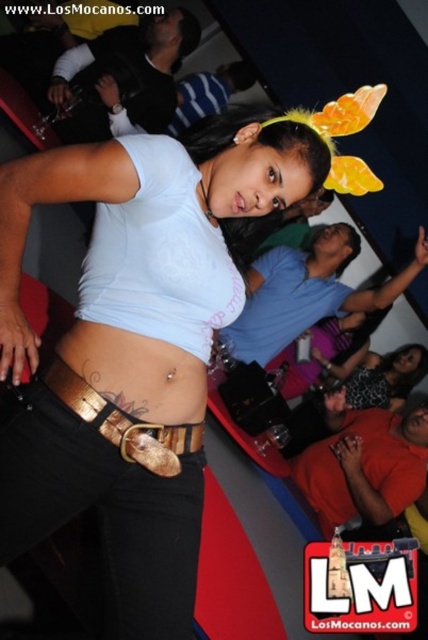
Question: Does matte white tank top at center appear on the right side of gold metallic belt at lower center?

Choices:
 (A) no
 (B) yes

Answer: (A)

Question: Among these points, which one is farthest from the camera?

Choices:
 (A) (187, 460)
 (B) (178, 458)
 (C) (371, 352)

Answer: (C)

Question: Is gold metallic belt at lower center to the right of matte black top at center from the viewer's perspective?

Choices:
 (A) no
 (B) yes

Answer: (A)

Question: Does matte white tank top at center have a greater width compared to matte black top at center?

Choices:
 (A) yes
 (B) no

Answer: (A)

Question: Considering the real-world distances, which object is farthest from the matte black top at center?

Choices:
 (A) gold metallic belt at lower center
 (B) matte white tank top at center

Answer: (A)

Question: Which of the following is the farthest from the observer?

Choices:
 (A) matte white tank top at center
 (B) matte black top at center
 (C) gold metallic belt at lower center

Answer: (B)